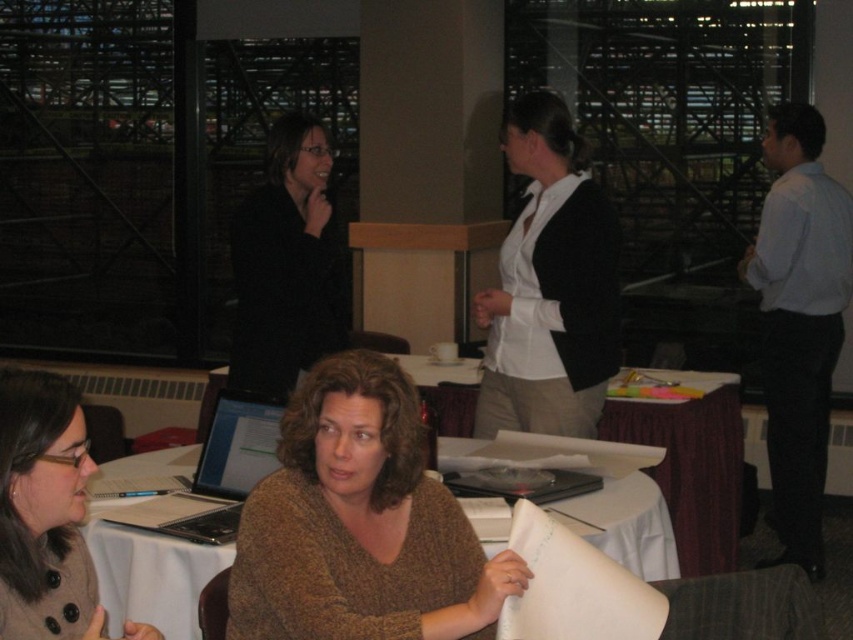
Can you confirm if white matte shirt at center is positioned above silver metallic laptop at lower left?

Yes, white matte shirt at center is above silver metallic laptop at lower left.

Does white matte shirt at center appear under silver metallic laptop at lower left?

Incorrect, white matte shirt at center is not positioned below silver metallic laptop at lower left.

Between point (514, 148) and point (231, 448), which one is positioned behind?

The point (514, 148) is more distant.

The width and height of the screenshot is (853, 640). I want to click on white matte shirt at center, so click(549, 285).

Which of these two, matte black sweater at center or brown wool sweater at lower left, stands shorter?

brown wool sweater at lower left

This screenshot has height=640, width=853. What do you see at coordinates (287, 264) in the screenshot?
I see `matte black sweater at center` at bounding box center [287, 264].

Locate an element on the screen. The image size is (853, 640). matte black sweater at center is located at coordinates (287, 264).

Is point (303, 554) positioned behind point (276, 120)?

No, it is not.

Find the location of `brown soft sweater at center`. brown soft sweater at center is located at coordinates (360, 524).

This screenshot has height=640, width=853. What do you see at coordinates (360, 524) in the screenshot?
I see `brown soft sweater at center` at bounding box center [360, 524].

The height and width of the screenshot is (640, 853). I want to click on brown soft sweater at center, so click(x=360, y=524).